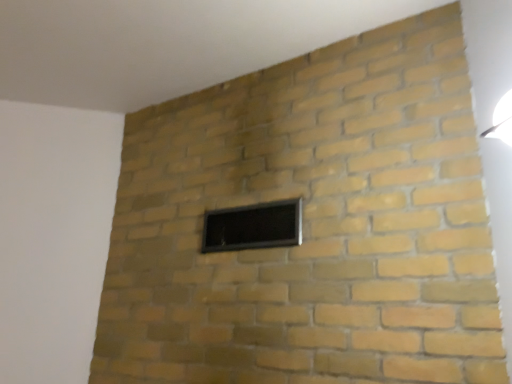
Question: Relative to white glossy light fixture at upper right, is black glass window at center in front or behind?

Choices:
 (A) front
 (B) behind

Answer: (B)

Question: From the image's perspective, is black glass window at center above or below white glossy light fixture at upper right?

Choices:
 (A) above
 (B) below

Answer: (B)

Question: Looking at the image, does black glass window at center seem bigger or smaller compared to white glossy light fixture at upper right?

Choices:
 (A) big
 (B) small

Answer: (B)

Question: Is white glossy light fixture at upper right bigger or smaller than black glass window at center?

Choices:
 (A) small
 (B) big

Answer: (B)

Question: Considering the positions of white glossy light fixture at upper right and black glass window at center in the image, is white glossy light fixture at upper right taller or shorter than black glass window at center?

Choices:
 (A) tall
 (B) short

Answer: (B)

Question: Visually, is white glossy light fixture at upper right positioned to the left or to the right of black glass window at center?

Choices:
 (A) left
 (B) right

Answer: (B)

Question: Is white glossy light fixture at upper right spatially inside black glass window at center, or outside of it?

Choices:
 (A) inside
 (B) outside

Answer: (B)